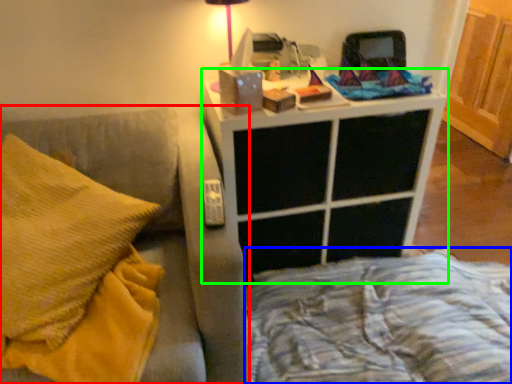
Question: Based on their relative distances, which object is farther from furniture (highlighted by a red box)? Choose from bed frame (highlighted by a blue box) and nightstand (highlighted by a green box).

Choices:
 (A) bed frame
 (B) nightstand

Answer: (A)